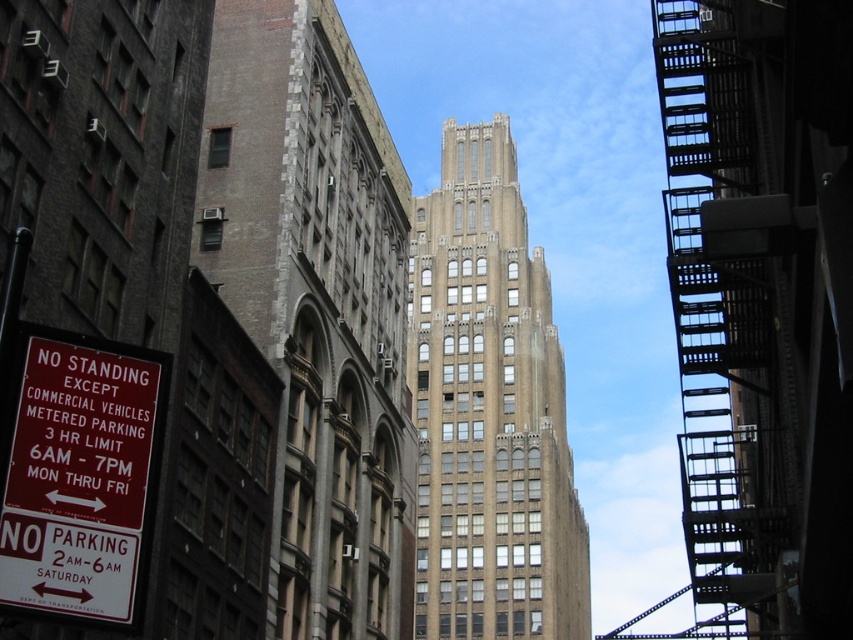
Question: Which object is closer to the camera taking this photo?

Choices:
 (A) brown stone tower at center
 (B) brown stone building at center
 (C) red plastic sign at lower left

Answer: (C)

Question: Which object is the closest to the red plastic sign at lower left?

Choices:
 (A) brown stone tower at center
 (B) brown stone building at center

Answer: (B)

Question: Is brown stone building at center wider than brown stone tower at center?

Choices:
 (A) yes
 (B) no

Answer: (B)

Question: Does brown stone building at center have a greater width compared to red plastic sign at lower left?

Choices:
 (A) no
 (B) yes

Answer: (B)

Question: Is brown stone building at center smaller than brown stone tower at center?

Choices:
 (A) no
 (B) yes

Answer: (B)

Question: Which object is positioned closest to the brown stone building at center?

Choices:
 (A) brown stone tower at center
 (B) red plastic sign at lower left

Answer: (B)